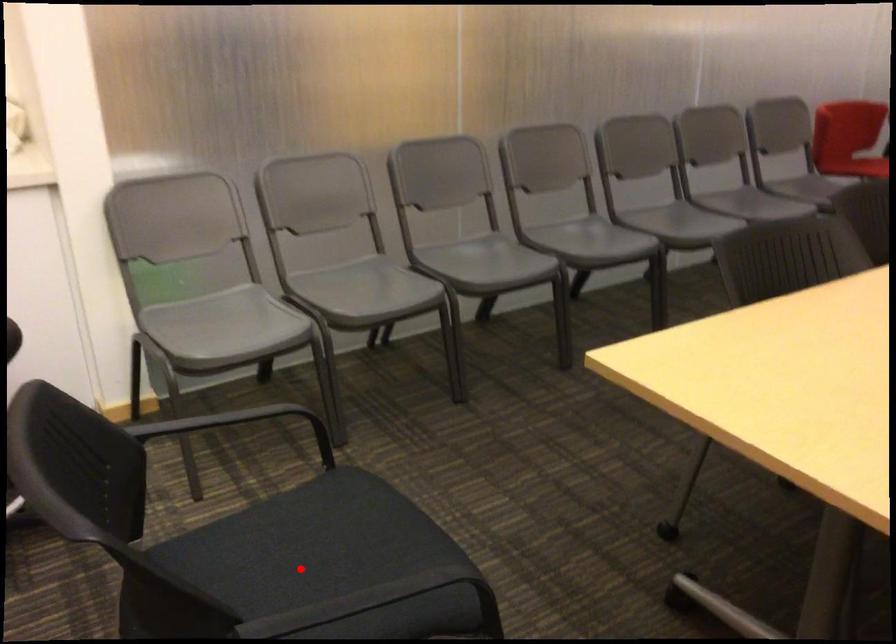
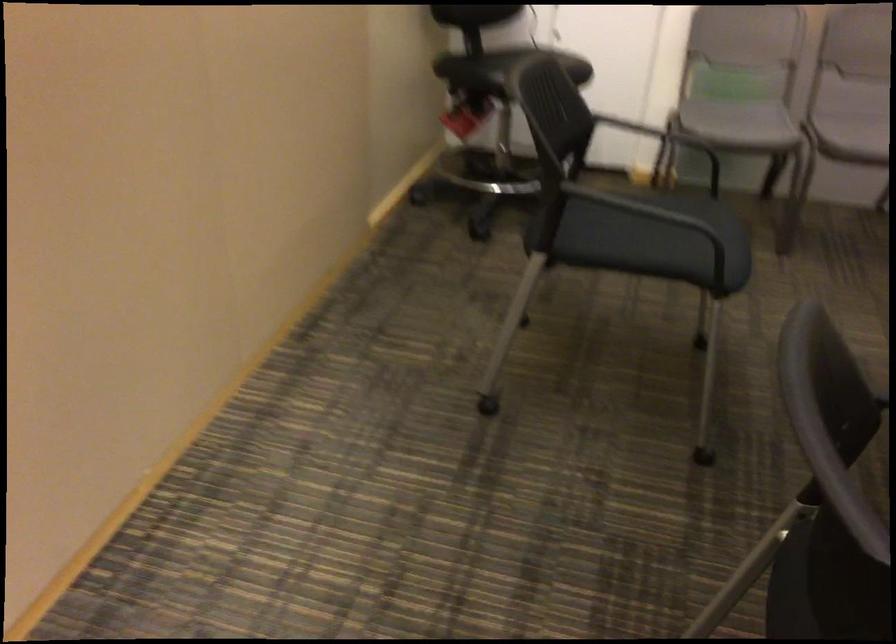
Question: A red point is marked in image1. In image2, is the corresponding 3D point closer to the camera or farther? Reply with the corresponding letter.

Choices:
 (A) The corresponding 3D point is closer.
 (B) The corresponding 3D point is farther.

Answer: (B)